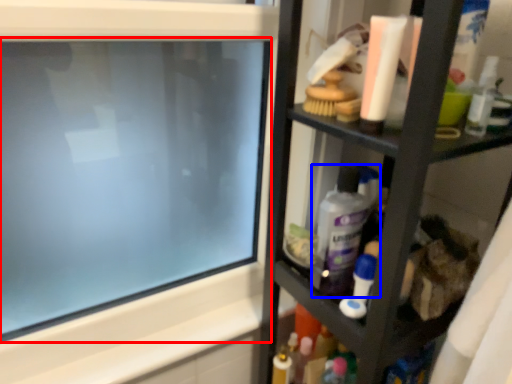
Question: Which point is further to the camera, computer screen (highlighted by a red box) or cleaning product (highlighted by a blue box)?

Choices:
 (A) computer screen
 (B) cleaning product

Answer: (B)